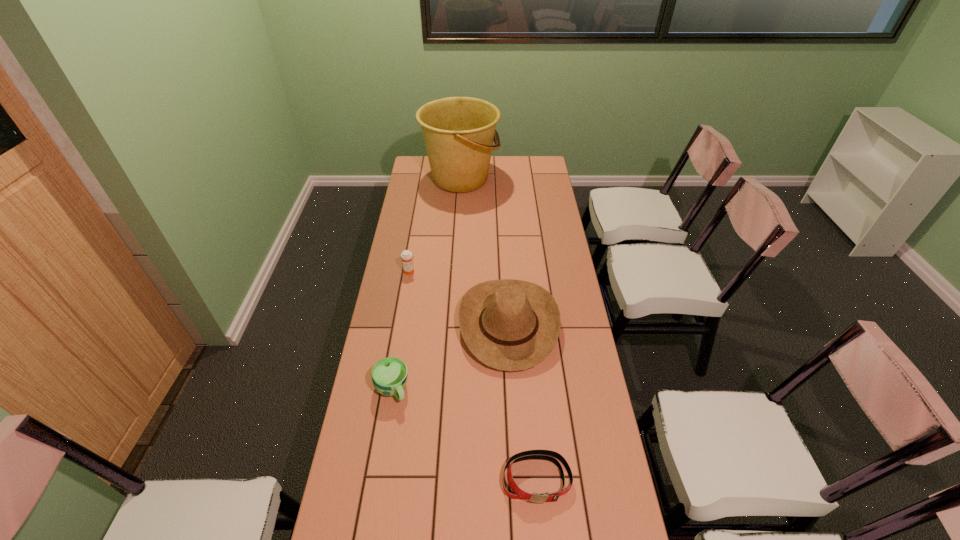
Find the location of a particular element. The width and height of the screenshot is (960, 540). dog collar located at the right edge is located at coordinates (552, 456).

At what (x,y) coordinates should I click in order to perform the action: click on object that is at the far left corner. Please return your answer as a coordinate pair (x, y). Image resolution: width=960 pixels, height=540 pixels. Looking at the image, I should click on (458, 132).

Find the location of `free space at the left edge of the desktop`. free space at the left edge of the desktop is located at coordinates coord(399,406).

Locate an element on the screen. The image size is (960, 540). vacant space at the right edge of the desktop is located at coordinates (594, 491).

Locate an element on the screen. This screenshot has width=960, height=540. vacant area at the far right corner of the desktop is located at coordinates (521, 165).

This screenshot has width=960, height=540. What are the coordinates of `free space between the fourth shortest object and the cup` in the screenshot? It's located at (450, 357).

Find the location of a particular element. The height and width of the screenshot is (540, 960). free spot between the nearest object and the second tallest object is located at coordinates (522, 402).

The width and height of the screenshot is (960, 540). What are the coordinates of `free space between the farthest object and the medicine` in the screenshot? It's located at (435, 225).

This screenshot has height=540, width=960. I want to click on vacant space that's between the shortest object and the cowboy hat, so click(522, 402).

Image resolution: width=960 pixels, height=540 pixels. What are the coordinates of `unoccupied area between the dog collar and the cowboy hat` in the screenshot? It's located at (522, 402).